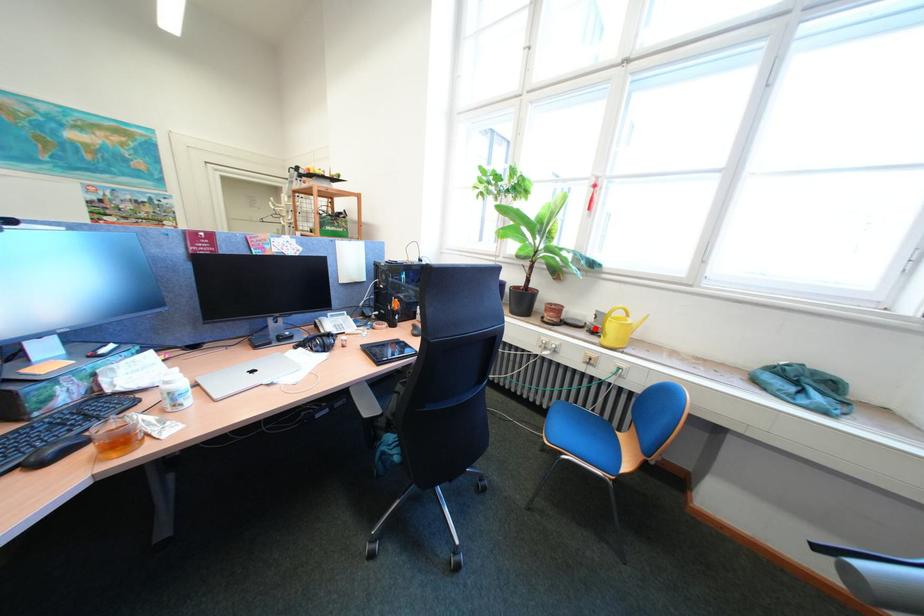
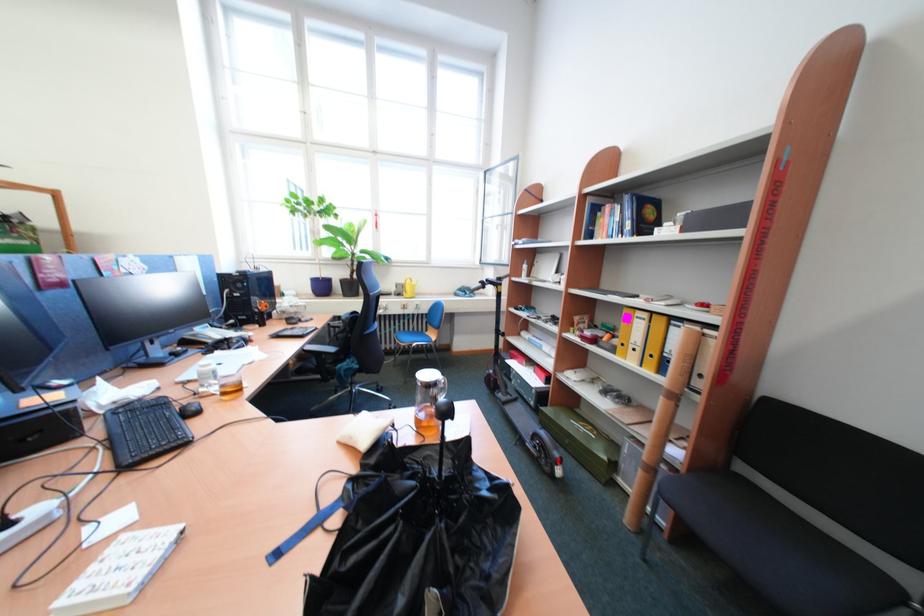
Where in the second image is the point corresponding to the highlighted location from the first image?

(403, 296)